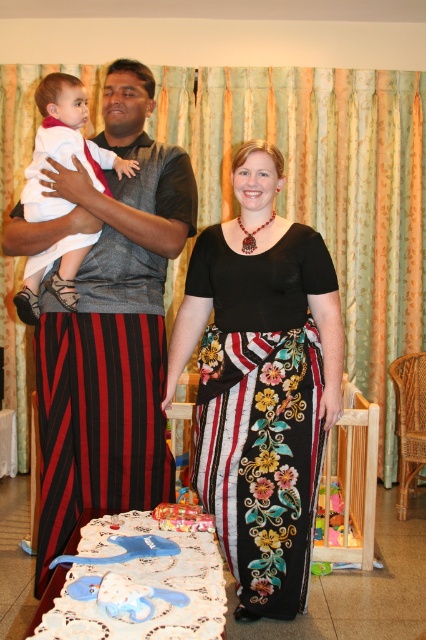
Does black floral skirt at center appear over white soft baby at center?

Incorrect, black floral skirt at center is not positioned above white soft baby at center.

Does point (282, 362) come closer to viewer compared to point (51, 202)?

No, it is behind (51, 202).

Is point (340, 337) farther from camera compared to point (46, 220)?

Yes, it is.

Where is `black floral skirt at center`? Image resolution: width=426 pixels, height=640 pixels. black floral skirt at center is located at coordinates (261, 384).

Can you confirm if floral fabric skirt at center is positioned below white soft baby at center?

Indeed, floral fabric skirt at center is positioned under white soft baby at center.

Is point (161, 356) positioned behind point (48, 284)?

Yes.

Identify the location of floral fabric skirt at center. This screenshot has width=426, height=640. (261, 380).

Which is more to the right, floral fabric skirt at center or black floral skirt at center?

From the viewer's perspective, black floral skirt at center appears more on the right side.

Can you confirm if floral fabric skirt at center is shorter than black floral skirt at center?

In fact, floral fabric skirt at center may be taller than black floral skirt at center.

Where is `floral fabric skirt at center`? This screenshot has width=426, height=640. floral fabric skirt at center is located at coordinates (261, 380).